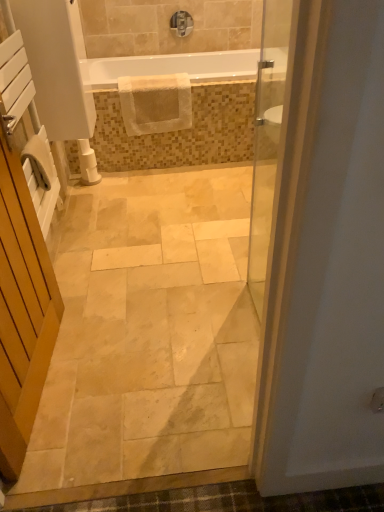
Question: From the image's perspective, would you say natural stone floor at center is shown under white wooden screen door at left?

Choices:
 (A) no
 (B) yes

Answer: (B)

Question: Is natural stone floor at center not inside white wooden screen door at left?

Choices:
 (A) yes
 (B) no

Answer: (A)

Question: Is natural stone floor at center closer to the viewer compared to white wooden screen door at left?

Choices:
 (A) no
 (B) yes

Answer: (A)

Question: Is natural stone floor at center not near white wooden screen door at left?

Choices:
 (A) no
 (B) yes

Answer: (A)

Question: Is natural stone floor at center to the right of white wooden screen door at left from the viewer's perspective?

Choices:
 (A) yes
 (B) no

Answer: (A)

Question: Would you say natural stone floor at center contains white wooden screen door at left?

Choices:
 (A) yes
 (B) no

Answer: (B)

Question: From a real-world perspective, is white textured mat at upper center beneath white plastic toilet paper at lower left?

Choices:
 (A) no
 (B) yes

Answer: (A)

Question: Does white textured mat at upper center have a smaller size compared to white plastic toilet paper at lower left?

Choices:
 (A) no
 (B) yes

Answer: (A)

Question: Considering the relative sizes of white textured mat at upper center and white plastic toilet paper at lower left in the image provided, is white textured mat at upper center wider than white plastic toilet paper at lower left?

Choices:
 (A) yes
 (B) no

Answer: (A)

Question: Does white textured mat at upper center turn towards white plastic toilet paper at lower left?

Choices:
 (A) no
 (B) yes

Answer: (A)

Question: Considering the relative sizes of white textured mat at upper center and white plastic toilet paper at lower left in the image provided, is white textured mat at upper center taller than white plastic toilet paper at lower left?

Choices:
 (A) no
 (B) yes

Answer: (B)

Question: From a real-world perspective, is white textured mat at upper center physically above white plastic toilet paper at lower left?

Choices:
 (A) yes
 (B) no

Answer: (A)

Question: Is white glossy bathtub at upper center looking in the opposite direction of matte silver faucet at upper center?

Choices:
 (A) no
 (B) yes

Answer: (A)